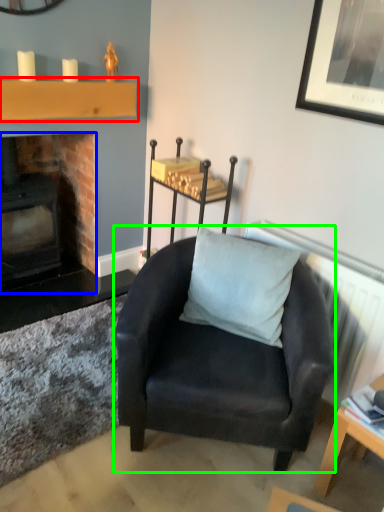
Question: Based on their relative distances, which object is nearer to shelf (highlighted by a red box)? Choose from fireplace (highlighted by a blue box) and chair (highlighted by a green box).

Choices:
 (A) fireplace
 (B) chair

Answer: (A)